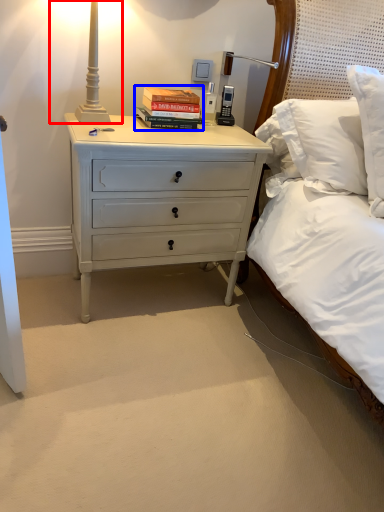
Question: Which of the following is the closest to the observer, bedside lamp (highlighted by a red box) or book (highlighted by a blue box)?

Choices:
 (A) bedside lamp
 (B) book

Answer: (A)